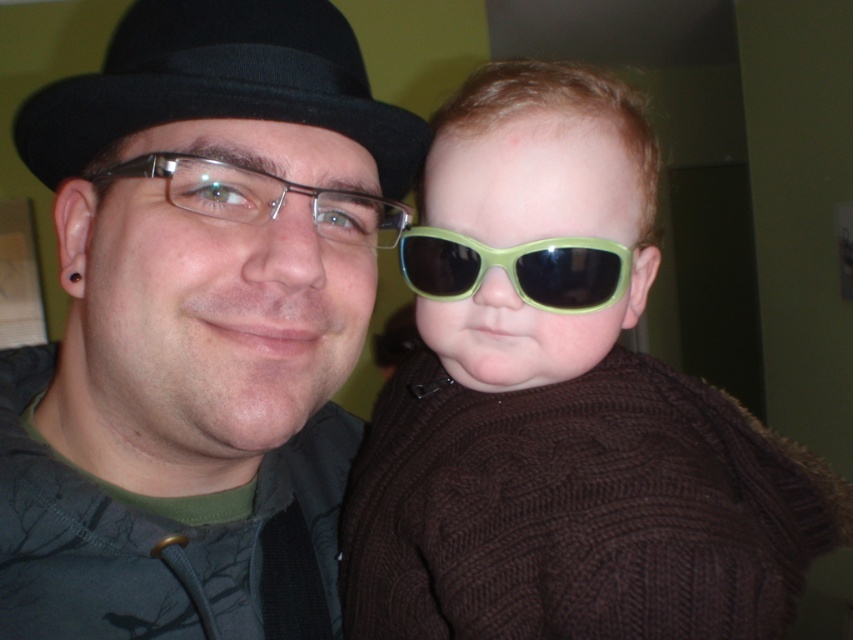
Question: Can you confirm if matte black hat at upper left is positioned below green matte sunglasses at center?

Choices:
 (A) yes
 (B) no

Answer: (A)

Question: Which point is farther to the camera?

Choices:
 (A) (242, 65)
 (B) (49, 180)

Answer: (B)

Question: Which of these objects is positioned closest to the black felt fedora at left?

Choices:
 (A) clear plastic glasses at center
 (B) matte black hat at upper left

Answer: (A)

Question: Does matte black hat at upper left appear under green plastic sunglasses at center?

Choices:
 (A) yes
 (B) no

Answer: (A)

Question: Which of these objects is positioned farthest from the green plastic sunglasses at center?

Choices:
 (A) matte black hat at upper left
 (B) black felt fedora at left

Answer: (A)

Question: Does green matte sunglasses at center have a smaller size compared to green plastic sunglasses at center?

Choices:
 (A) yes
 (B) no

Answer: (B)